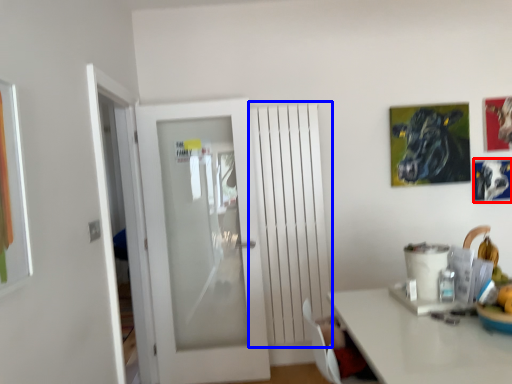
Question: Which object appears closest to the camera in this image, picture frame (highlighted by a red box) or radiator (highlighted by a blue box)?

Choices:
 (A) picture frame
 (B) radiator

Answer: (B)